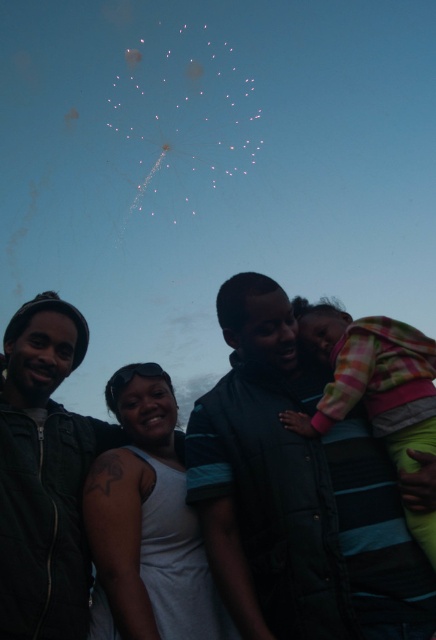
You are a photographer trying to capture a closeup of the matte black jacket at center. Given that your camera has a focal length of 50mm and you are standing at a distance of 2 meters from the jacket, will the jacket fill the frame vertically? The sensor size of your camera is 24mm x 36mm. Please calculate and explain.

The sensor height is 24mm. The distance to the jacket is 2 meters. The vertical field of view can be calculated using the formula tan fov_y 2. The height of the jacket is not provided, so it is impossible to determine if it will fill the frame vertically.

You are a photographer trying to capture the fireworks display in the background. You notice two jackets in your frame, the matte black jacket at center and the dark green jacket at left. Which jacket should you focus on to ensure it appears larger in your photo?

The matte black jacket at center has a greater height compared to the dark green jacket at left, so focusing on the matte black jacket at center will make it appear larger in the photo.

You are standing in front of the fireworks display and want to know which of the two points, point (367,492) or point (422,451), is closer to you. Based on the scene, can you determine this?

Point (367,492) is closer to you because it is further to the viewer than point (422,451).